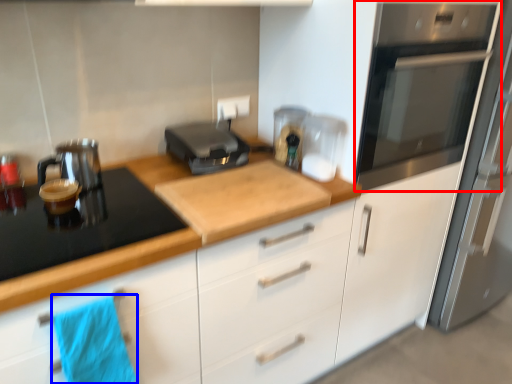
Question: Which object appears closest to the camera in this image, home appliance (highlighted by a red box) or beach towel (highlighted by a blue box)?

Choices:
 (A) home appliance
 (B) beach towel

Answer: (B)